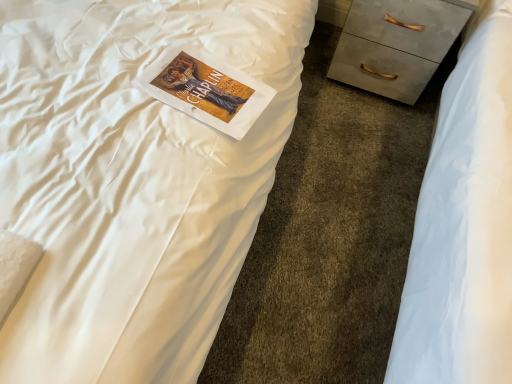
Question: Does matte white paperback book at center have a greater width compared to matte gray chest of drawers at right?

Choices:
 (A) yes
 (B) no

Answer: (B)

Question: Considering the relative positions of matte white paperback book at center and matte gray chest of drawers at right in the image provided, is matte white paperback book at center behind matte gray chest of drawers at right?

Choices:
 (A) yes
 (B) no

Answer: (B)

Question: Considering the relative sizes of matte white paperback book at center and matte gray chest of drawers at right in the image provided, is matte white paperback book at center thinner than matte gray chest of drawers at right?

Choices:
 (A) yes
 (B) no

Answer: (A)

Question: From a real-world perspective, is matte white paperback book at center positioned over matte gray chest of drawers at right based on gravity?

Choices:
 (A) no
 (B) yes

Answer: (B)

Question: Does matte white paperback book at center have a lesser height compared to matte gray chest of drawers at right?

Choices:
 (A) no
 (B) yes

Answer: (B)

Question: Is matte white paperback book at center not near matte gray chest of drawers at right?

Choices:
 (A) yes
 (B) no

Answer: (B)

Question: Is matte gray chest of drawers at right positioned before matte white paperback book at center?

Choices:
 (A) yes
 (B) no

Answer: (B)

Question: Is matte gray chest of drawers at right oriented towards matte white paperback book at center?

Choices:
 (A) no
 (B) yes

Answer: (B)

Question: Can you confirm if matte gray chest of drawers at right is smaller than matte white paperback book at center?

Choices:
 (A) no
 (B) yes

Answer: (A)

Question: Is matte white paperback book at center located within matte gray chest of drawers at right?

Choices:
 (A) no
 (B) yes

Answer: (A)

Question: From a real-world perspective, is matte gray chest of drawers at right under matte white paperback book at center?

Choices:
 (A) yes
 (B) no

Answer: (A)

Question: Can you confirm if matte gray chest of drawers at right is taller than matte white paperback book at center?

Choices:
 (A) no
 (B) yes

Answer: (B)

Question: Is matte gray chest of drawers at right wider or thinner than matte white paperback book at center?

Choices:
 (A) wide
 (B) thin

Answer: (A)